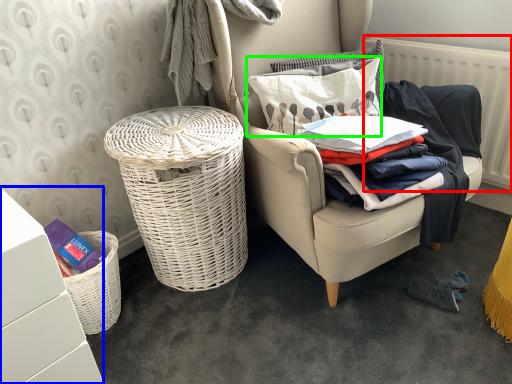
Question: Considering the real-world distances, which object is closest to radiator (highlighted by a red box)? vanity (highlighted by a blue box) or pillow (highlighted by a green box).

Choices:
 (A) vanity
 (B) pillow

Answer: (B)